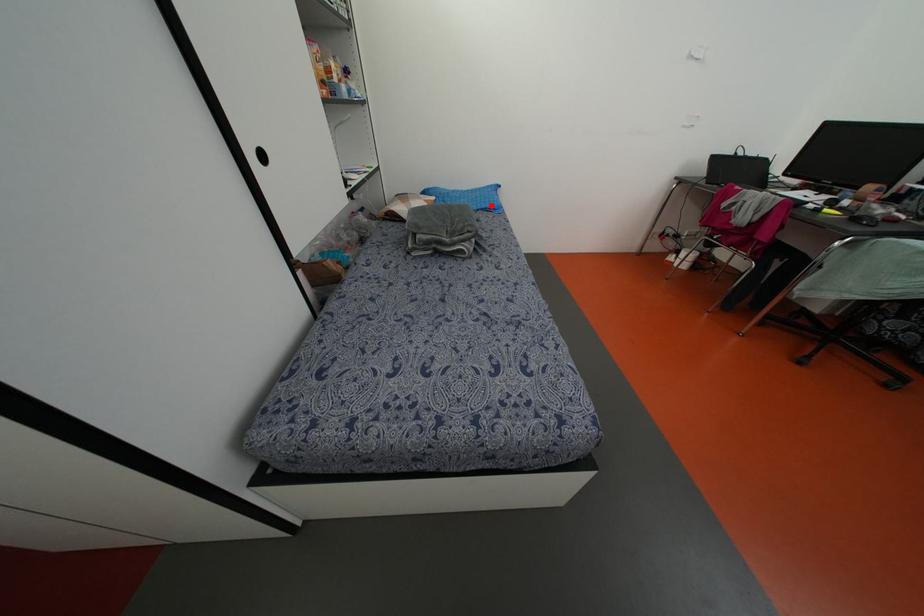
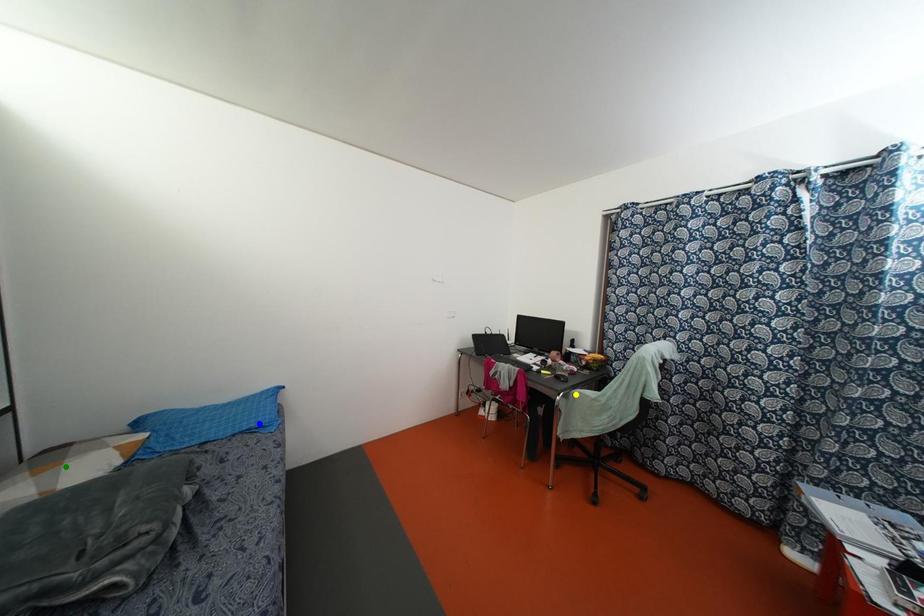
Question: I am providing you with two images of the same scene from different viewpoints. A red point is marked on the first image. You are given multiple points on the second image. In image 2, which mark is for the same physical point as the one in image 1?

Choices:
 (A) blue point
 (B) green point
 (C) yellow point

Answer: (A)